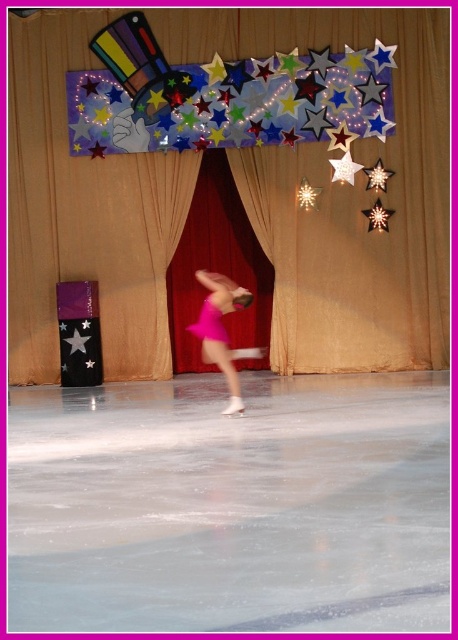
Question: Does white ice skating rink at center come behind red velvet curtain at center?

Choices:
 (A) no
 (B) yes

Answer: (A)

Question: Can you confirm if pink satin skirt at center is bigger than pink satin dress at center?

Choices:
 (A) yes
 (B) no

Answer: (A)

Question: Among these points, which one is farthest from the camera?

Choices:
 (A) (426, 202)
 (B) (189, 326)
 (C) (207, 275)

Answer: (B)

Question: Can you confirm if red velvet curtain at center is thinner than pink satin dress at center?

Choices:
 (A) yes
 (B) no

Answer: (B)

Question: Among these objects, which one is farthest from the camera?

Choices:
 (A) pink satin skirt at center
 (B) red velvet curtain at center
 (C) white ice skating rink at center

Answer: (B)

Question: Based on their relative distances, which object is farther from the white ice skating rink at center?

Choices:
 (A) pink satin dress at center
 (B) pink satin skirt at center
 (C) red velvet curtain at center

Answer: (C)